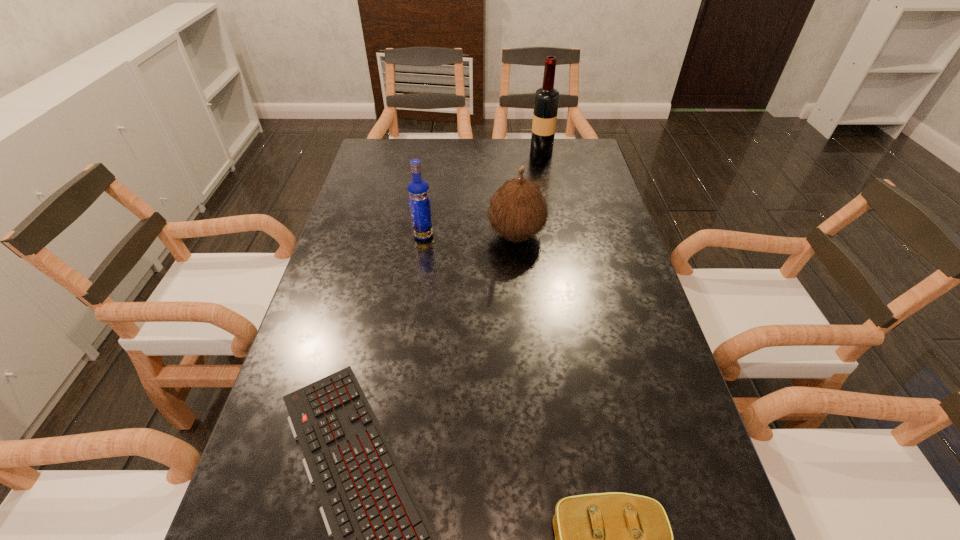
Locate an element on the screen. The image size is (960, 540). vacant area that lies between the coconut and the vodka is located at coordinates (469, 235).

Where is `object that is the third closest one to the second shortest object`? The image size is (960, 540). object that is the third closest one to the second shortest object is located at coordinates (418, 190).

Select which object appears as the second closest to the clutch bag. Please provide its 2D coordinates. Your answer should be formatted as a tuple, i.e. [(x, y)], where the tuple contains the x and y coordinates of a point satisfying the conditions above.

[(517, 210)]

Where is `blank area in the image that satisfies the following two spatial constraints: 1. on the front side of the farthest object; 2. on the surface of the coconut`? The width and height of the screenshot is (960, 540). blank area in the image that satisfies the following two spatial constraints: 1. on the front side of the farthest object; 2. on the surface of the coconut is located at coordinates (557, 234).

Locate an element on the screen. The height and width of the screenshot is (540, 960). free region that satisfies the following two spatial constraints: 1. on the back side of the wine bottle; 2. on the right side of the vodka is located at coordinates (435, 153).